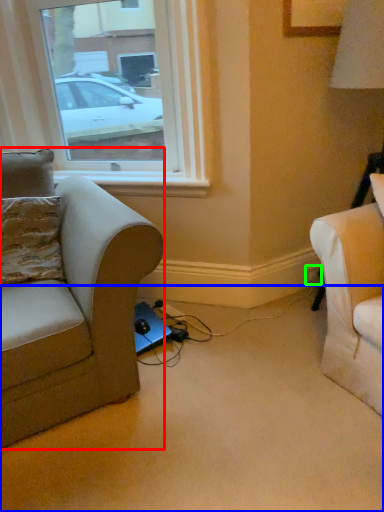
Question: Which is farther away from studio couch (highlighted by a red box)? plain (highlighted by a blue box) or electric outlet (highlighted by a green box)?

Choices:
 (A) plain
 (B) electric outlet

Answer: (B)